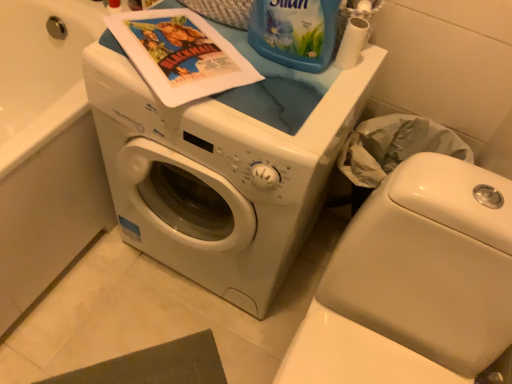
Question: In the image, is white glossy washer at lower left on the left side or the right side of blue plastic bottle at upper center?

Choices:
 (A) left
 (B) right

Answer: (B)

Question: Is point (431, 355) positioned closer to the camera than point (286, 44)?

Choices:
 (A) farther
 (B) closer

Answer: (B)

Question: Estimate the real-world distances between objects in this image. Which object is closer to the white matte toilet paper at upper right?

Choices:
 (A) white glossy washing machine at center
 (B) matte paper comic book at upper center
 (C) blue plastic bottle at upper center
 (D) white glossy washer at lower left

Answer: (C)

Question: Estimate the real-world distances between objects in this image. Which object is farther from the white matte toilet paper at upper right?

Choices:
 (A) white glossy washing machine at center
 (B) matte paper comic book at upper center
 (C) blue plastic bottle at upper center
 (D) white glossy washer at lower left

Answer: (D)